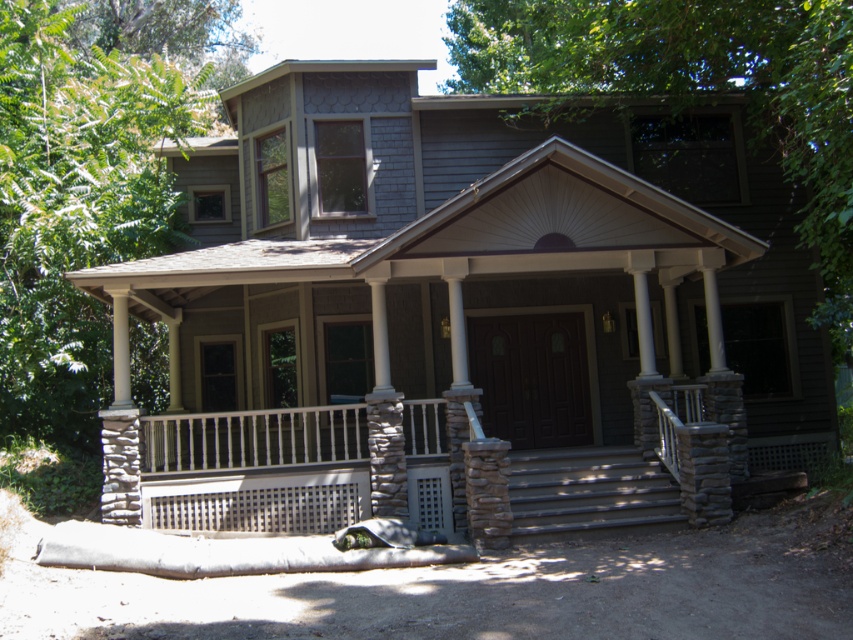
You are a delivery person trying to reach the front door of the house. You see the stone textured porch at center and the gray stone stairs at center. Which one is lower to the ground and easier to access?

The stone textured porch at center has a lesser height compared to the gray stone stairs at center, so it is lower to the ground and easier to access.

Based on the photo, you are a delivery person with a 5.5 feet wide package. You need to move the package from the stone textured porch at center to the gray stone stairs at center. Can the package fit through the space between them?

The distance between the stone textured porch at center and the gray stone stairs at center is 6.13 feet. Since the package is 5.5 feet wide, it can fit through the space as the distance is wider than the package.

You are a delivery person trying to park your van in front of the house. The van requires a wider space than the gray stone stairs at center. Can you park on the stone textured porch at center?

The stone textured porch at center has a lesser width compared to gray stone stairs at center, so the van cannot park on the stone textured porch at center since it is narrower than the required space.